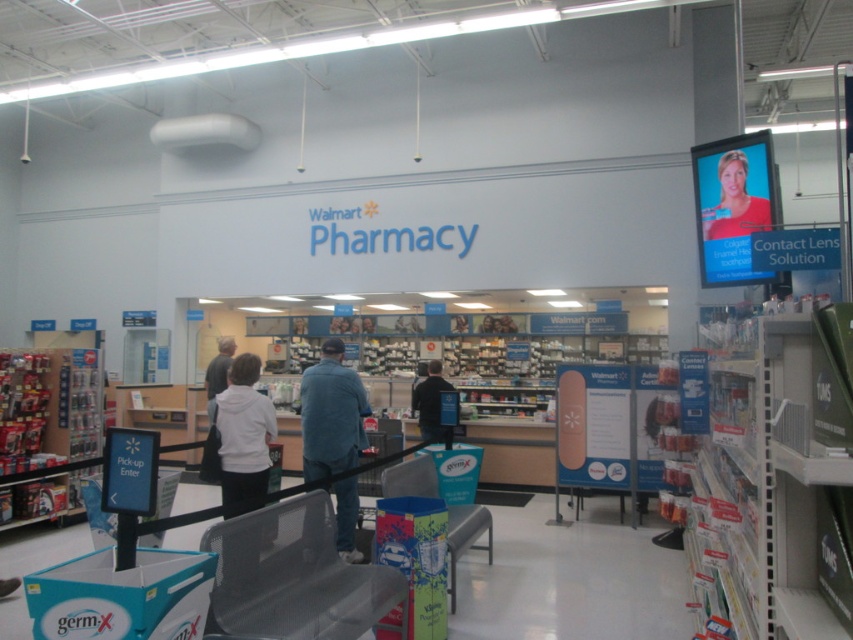
Is white matte jacket at center to the right of smooth skin face at upper right from the viewer's perspective?

Incorrect, white matte jacket at center is not on the right side of smooth skin face at upper right.

Which is behind, point (242, 436) or point (718, 168)?

Point (718, 168)

Is point (233, 422) closer to camera compared to point (730, 170)?

Yes.

This screenshot has width=853, height=640. I want to click on white matte jacket at center, so click(242, 436).

Can you confirm if smooth skin face at upper right is smaller than dark blue jeans at center?

Yes, smooth skin face at upper right is smaller than dark blue jeans at center.

Can you confirm if smooth skin face at upper right is wider than dark blue jeans at center?

Incorrect, smooth skin face at upper right's width does not surpass dark blue jeans at center's.

Identify the location of smooth skin face at upper right. (735, 202).

Based on the photo, does denim blue jeans at center appear on the right side of white matte jacket at center?

Indeed, denim blue jeans at center is positioned on the right side of white matte jacket at center.

Between point (317, 428) and point (222, 499), which one is positioned in front?

Positioned in front is point (222, 499).

Find the location of `denim blue jeans at center`. denim blue jeans at center is located at coordinates (331, 413).